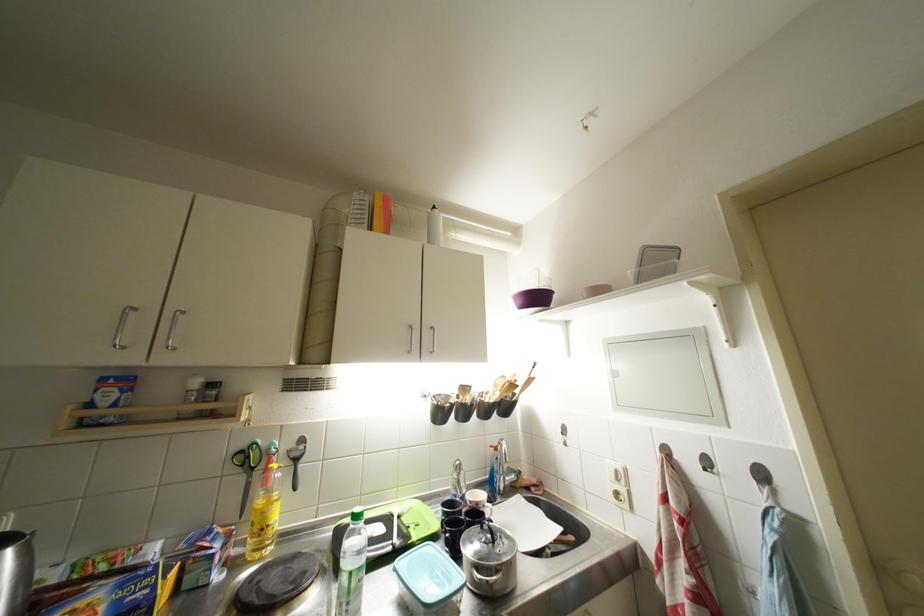
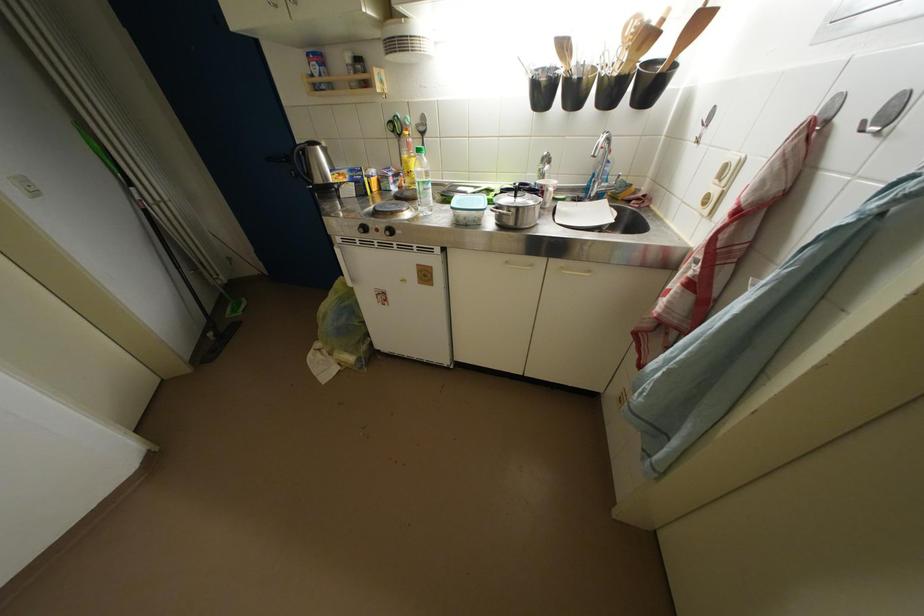
In the second image, find the point that corresponds to point 712,474 in the first image.

(869, 132)